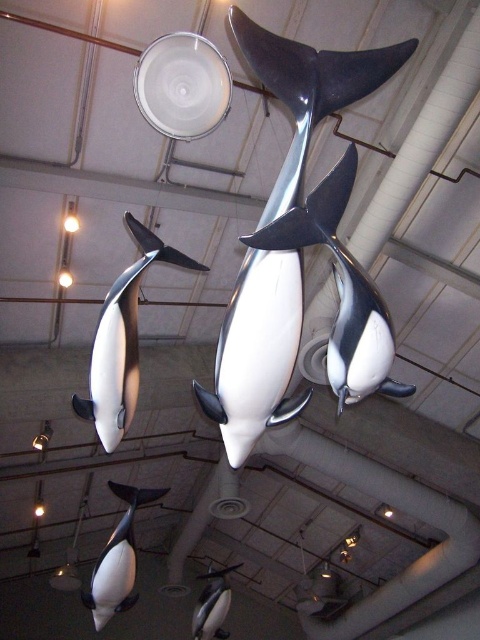
Question: Is the position of shiny metallic whale at center less distant than that of white glossy whale at lower left?

Choices:
 (A) yes
 (B) no

Answer: (A)

Question: Which point is farther to the camera?

Choices:
 (A) white glossy whale at lower left
 (B) shiny metallic whale at center
 (C) black and white dolphin at left

Answer: (A)

Question: Is black and white dolphin at left to the left of white glossy whale at lower left from the viewer's perspective?

Choices:
 (A) yes
 (B) no

Answer: (B)

Question: Can you confirm if shiny metallic whale at center is bigger than white glossy whale at lower left?

Choices:
 (A) yes
 (B) no

Answer: (B)

Question: Which object is closer to the camera taking this photo?

Choices:
 (A) black and white dolphin at left
 (B) shiny metallic whale at center
 (C) black and white dolphin at center

Answer: (C)

Question: Which object is closer to the camera taking this photo?

Choices:
 (A) shiny metallic whale at center
 (B) black and white dolphin at center
 (C) white glossy whale at lower left
 (D) black and white dolphin at left

Answer: (B)